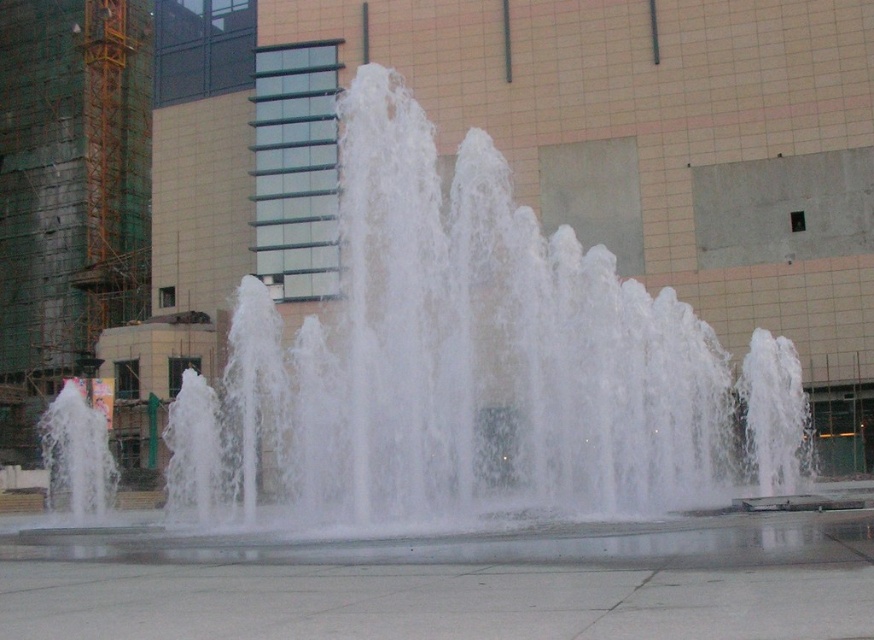
Question: Which object is farther from the camera taking this photo?

Choices:
 (A) gray concrete pavement at center
 (B) white frothy water at center

Answer: (B)

Question: Can you confirm if white frothy water at center is positioned below gray concrete pavement at center?

Choices:
 (A) no
 (B) yes

Answer: (A)

Question: Among these points, which one is farthest from the camera?

Choices:
 (A) (740, 628)
 (B) (385, 125)

Answer: (B)

Question: Considering the relative positions of white frothy water at center and gray concrete pavement at center in the image provided, where is white frothy water at center located with respect to gray concrete pavement at center?

Choices:
 (A) below
 (B) above

Answer: (B)

Question: Observing the image, what is the correct spatial positioning of white frothy water at center in reference to gray concrete pavement at center?

Choices:
 (A) above
 (B) below

Answer: (A)